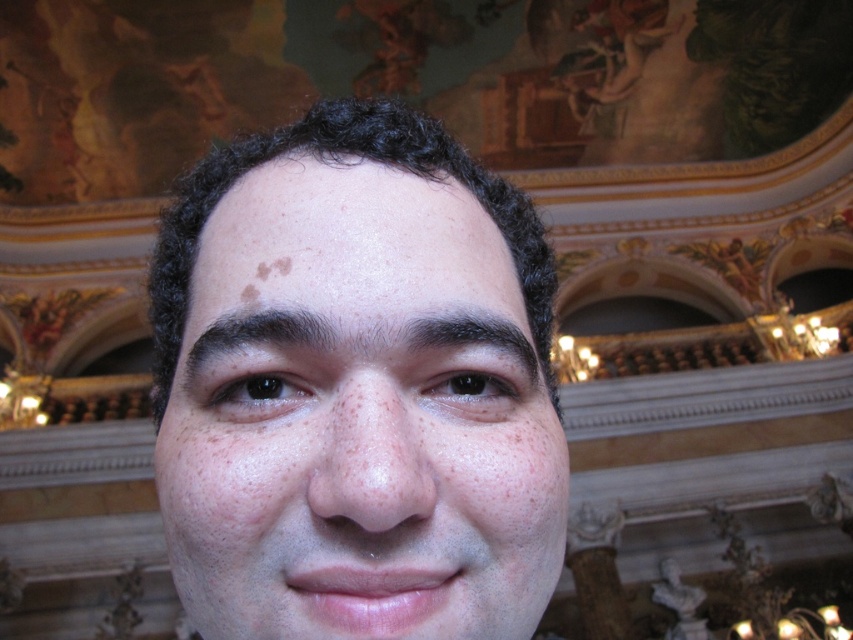
Question: Does smooth skin face at center come behind dark brown hair at center?

Choices:
 (A) yes
 (B) no

Answer: (B)

Question: From the image, what is the correct spatial relationship of brown matte eyebrow at upper left in relation to dark brown hair at center?

Choices:
 (A) above
 (B) below

Answer: (B)

Question: Which object is farther from the camera taking this photo?

Choices:
 (A) dark brown hair at center
 (B) brown matte eyebrow at upper left
 (C) smooth skin face at center

Answer: (A)

Question: Which of the following is the closest to the observer?

Choices:
 (A) brown matte eyebrow at upper left
 (B) smooth skin face at center
 (C) dark brown hair at center

Answer: (B)

Question: Is smooth skin face at center in front of brown matte eyebrow at upper left?

Choices:
 (A) no
 (B) yes

Answer: (B)

Question: Which of these objects is positioned closest to the dark brown hair at center?

Choices:
 (A) smooth skin face at center
 (B) brown matte eyebrow at upper left

Answer: (B)